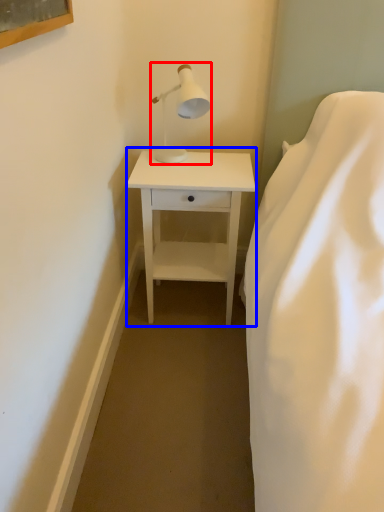
Question: Among these objects, which one is farthest to the camera, table lamp (highlighted by a red box) or nightstand (highlighted by a blue box)?

Choices:
 (A) table lamp
 (B) nightstand

Answer: (B)